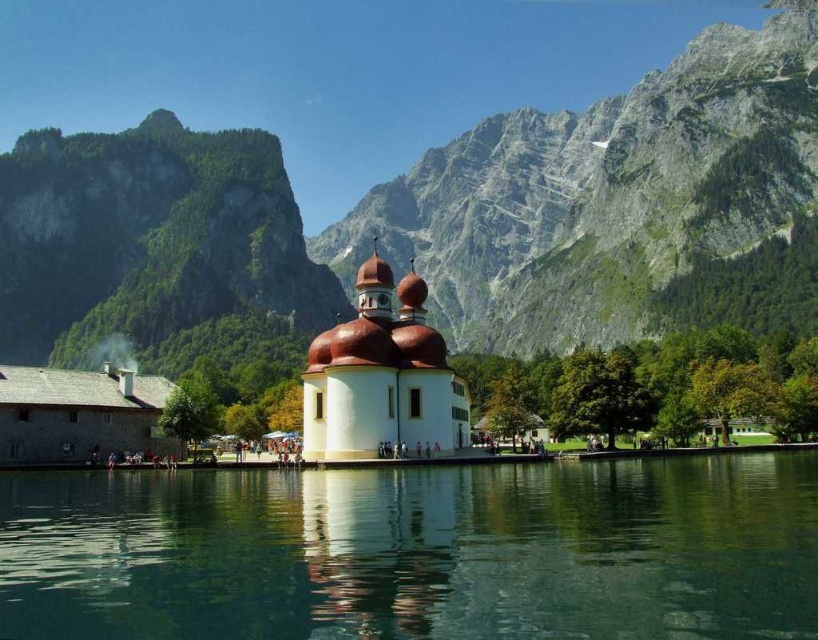
In the scene shown: You are an architect planning to build a small observation deck between the granite rock formation at upper center and the white smooth chapel at center. Considering their widths, which object will require more space on the deck to accommodate its width?

The granite rock formation at upper center has a greater width than the white smooth chapel at center, so it will require more space on the deck to accommodate its width.

You are a hiker planning to take a photo of the granite rock formation at upper center. Based on the scene description, where should you position yourself to capture the rock formation in the upper center of your frame?

The granite rock formation at upper center is located at point (x=434, y=224), so you should position yourself to aim your camera towards that coordinate to capture it in the upper center of your frame.